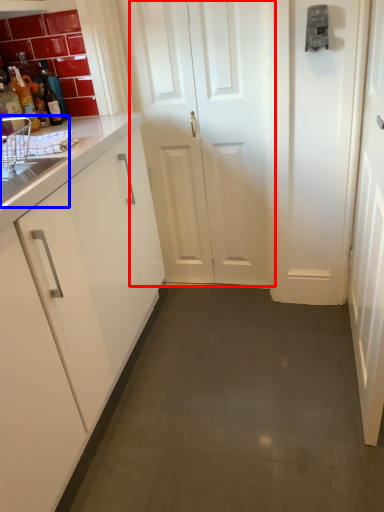
Question: Among these objects, which one is farthest to the camera, door (highlighted by a red box) or sink (highlighted by a blue box)?

Choices:
 (A) door
 (B) sink

Answer: (A)